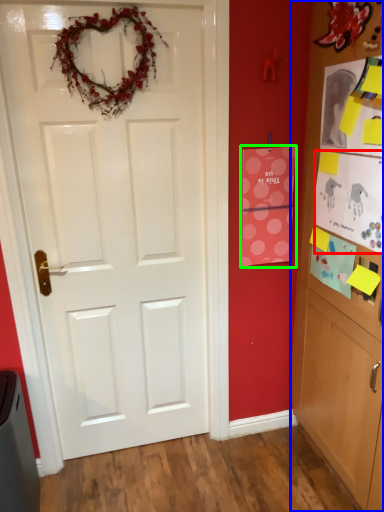
Question: Considering the real-world distances, which object is closest to postcard (highlighted by a red box)? cabinetry (highlighted by a blue box) or postcard (highlighted by a green box).

Choices:
 (A) cabinetry
 (B) postcard

Answer: (A)